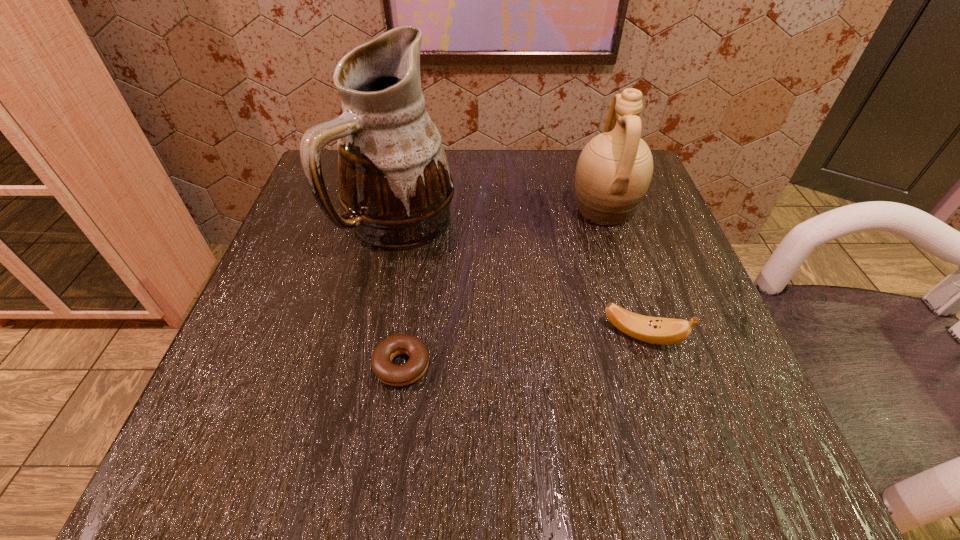
You are a GUI agent. You are given a task and a screenshot of the screen. Output one action in this format:
    pyautogui.click(x=<x>, y=<y>)
    Task: Click on the free area in between the left pitcher and the third shortest object
    
    Given the screenshot: What is the action you would take?
    pyautogui.click(x=502, y=217)

Identify the location of object identified as the third closest to the shorter pitcher. This screenshot has width=960, height=540. (391, 374).

Select which object appears as the third closest to the tallest object. Please provide its 2D coordinates. Your answer should be formatted as a tuple, i.e. [(x, y)], where the tuple contains the x and y coordinates of a point satisfying the conditions above.

[(663, 331)]

Where is `vacant area in the image that satisfies the following two spatial constraints: 1. from the spout of the doughnut; 2. on the left side of the taller pitcher`? The height and width of the screenshot is (540, 960). vacant area in the image that satisfies the following two spatial constraints: 1. from the spout of the doughnut; 2. on the left side of the taller pitcher is located at coordinates (372, 366).

At what (x,y) coordinates should I click in order to perform the action: click on free space in the image that satisfies the following two spatial constraints: 1. from the spout of the shortest object; 2. on the right side of the left pitcher. Please return your answer as a coordinate pair (x, y). Image resolution: width=960 pixels, height=540 pixels. Looking at the image, I should click on (372, 366).

Where is `blank space that satisfies the following two spatial constraints: 1. from the spout of the left pitcher; 2. on the right side of the doughnut`? blank space that satisfies the following two spatial constraints: 1. from the spout of the left pitcher; 2. on the right side of the doughnut is located at coordinates tap(372, 366).

What are the coordinates of `free space in the image that satisfies the following two spatial constraints: 1. from the spout of the second shortest object; 2. on the left side of the left pitcher` in the screenshot? It's located at (378, 335).

This screenshot has height=540, width=960. What are the coordinates of `free space that satisfies the following two spatial constraints: 1. from the spout of the shortest object; 2. on the left side of the taller pitcher` in the screenshot? It's located at (372, 366).

What are the coordinates of `free space that satisfies the following two spatial constraints: 1. from the spout of the second shortest object; 2. on the left side of the taller pitcher` in the screenshot? It's located at (378, 335).

The image size is (960, 540). Identify the location of blank area in the image that satisfies the following two spatial constraints: 1. from the spout of the tallest object; 2. on the right side of the shortest object. (372, 366).